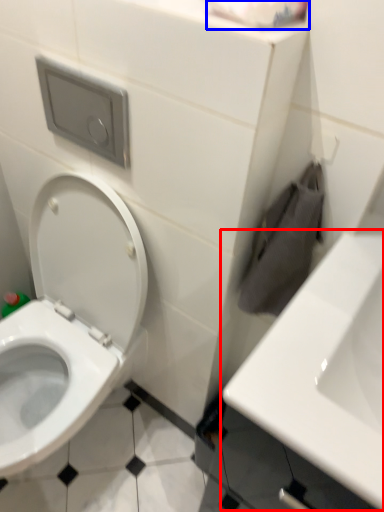
Question: Which object is closer to the camera taking this photo, sink (highlighted by a red box) or toilet paper (highlighted by a blue box)?

Choices:
 (A) sink
 (B) toilet paper

Answer: (A)